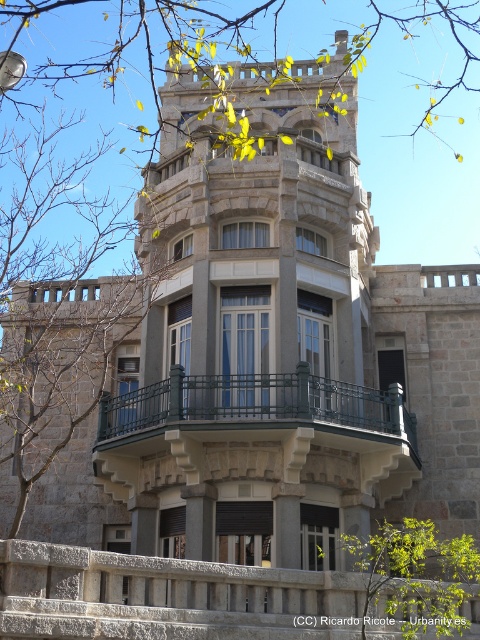
Between point (0, 595) and point (219, 385), which one is positioned behind?

Positioned behind is point (219, 385).

Which is behind, point (218, 564) or point (288, 378)?

The point (288, 378) is more distant.

This screenshot has width=480, height=640. In order to click on gray stone balustrade at lower center in this screenshot , I will do `click(168, 596)`.

Is point (214, 392) closer to camera compared to point (427, 604)?

That is False.

Between point (132, 408) and point (395, 618), which one is positioned in front?

Point (395, 618) is in front.

You are a GUI agent. You are given a task and a screenshot of the screen. Output one action in this format:
    pyautogui.click(x=<x>, y=<y>)
    Task: Click on the green wrought iron balcony at center
    
    Given the screenshot: What is the action you would take?
    pyautogui.click(x=256, y=424)

Can you confirm if gray stone balustrade at lower center is bigger than green leafy tree at center?

Correct, gray stone balustrade at lower center is larger in size than green leafy tree at center.

The height and width of the screenshot is (640, 480). What do you see at coordinates (168, 596) in the screenshot? I see `gray stone balustrade at lower center` at bounding box center [168, 596].

Which is in front, point (14, 561) or point (357, 547)?

Point (14, 561)

Where is `gray stone balustrade at lower center`? This screenshot has height=640, width=480. gray stone balustrade at lower center is located at coordinates (168, 596).